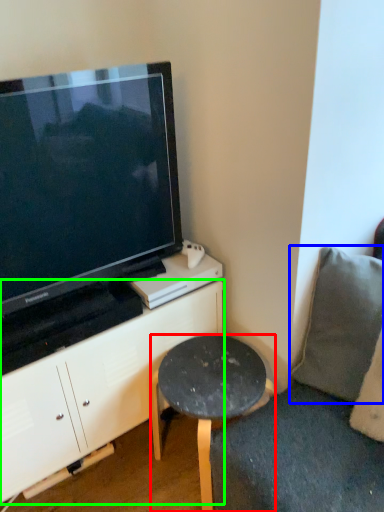
Question: Estimate the real-world distances between objects in this image. Which object is closer to stool (highlighted by a red box), pillow (highlighted by a blue box) or cabinetry (highlighted by a green box)?

Choices:
 (A) pillow
 (B) cabinetry

Answer: (B)